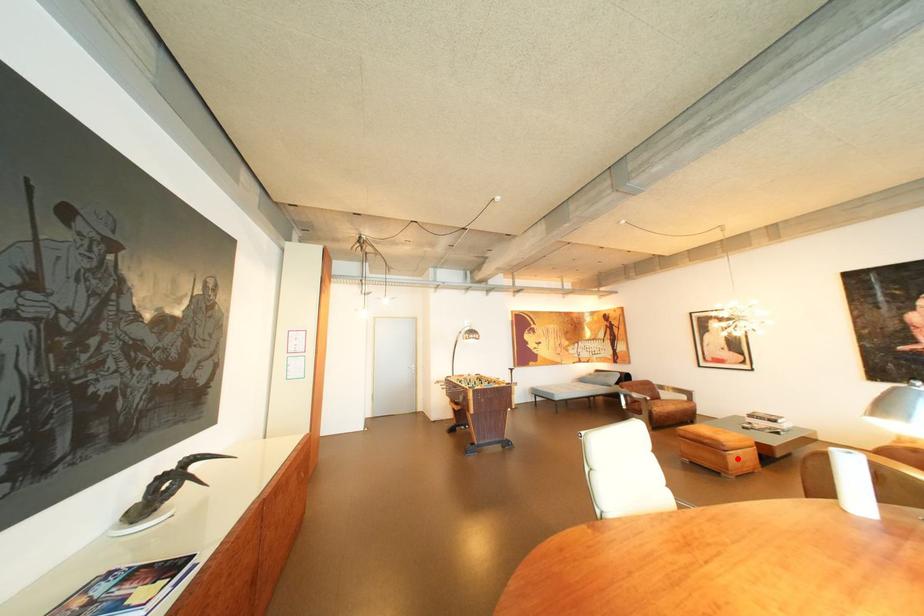
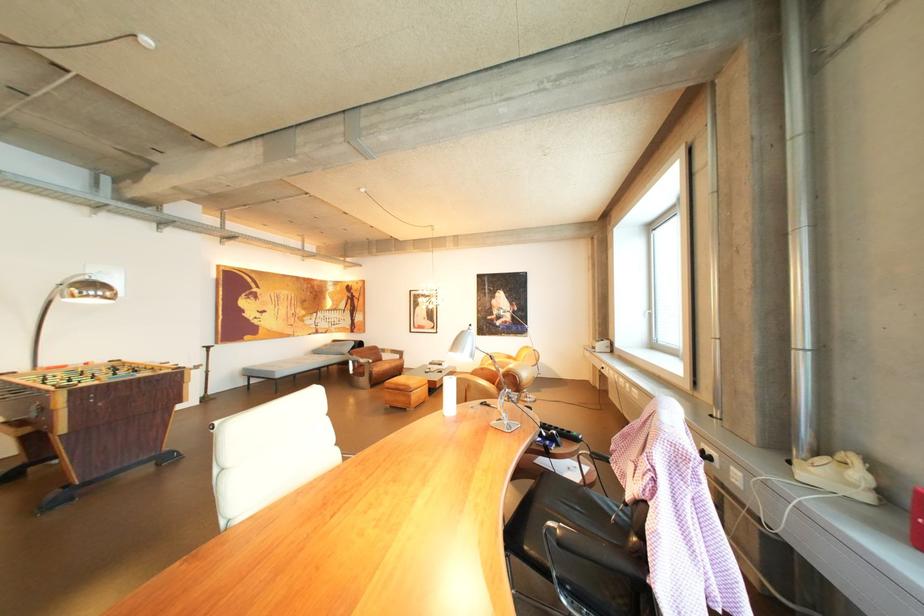
Question: I am providing you with two images of the same scene from different viewpoints. Image1 has a red point marked. In image2, the corresponding 3D location appears at what relative position? Reply with the corresponding letter.

Choices:
 (A) Closer
 (B) Farther

Answer: (B)